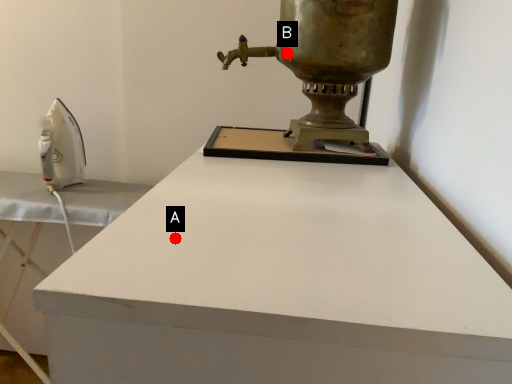
Question: Two points are circled on the image, labeled by A and B beside each circle. Which point appears farthest from the camera in this image?

Choices:
 (A) A is further
 (B) B is further

Answer: (B)